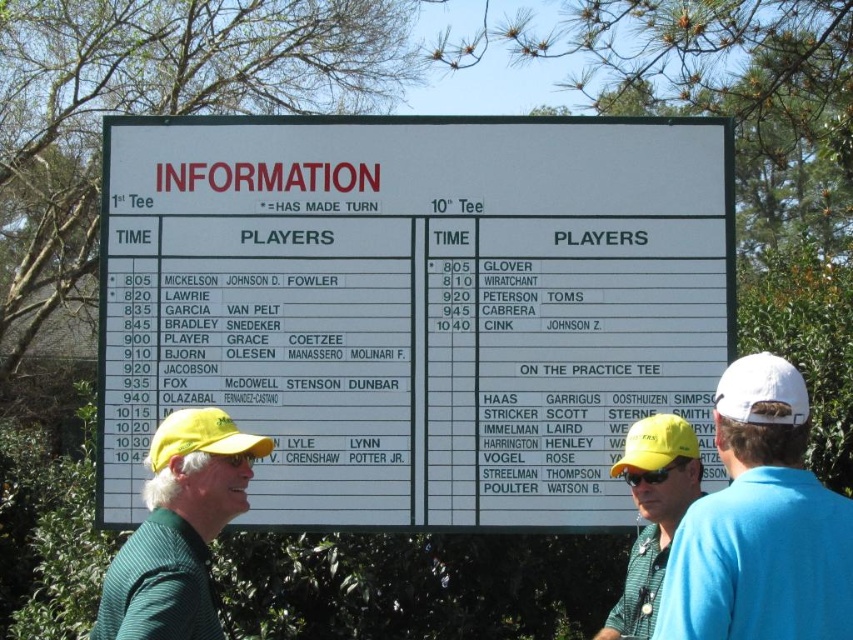
Does white plastic sign at center have a lesser width compared to yellow fabric cap at center?

No.

At what (x,y) coordinates should I click in order to perform the action: click on white plastic sign at center. Please return your answer as a coordinate pair (x, y). Looking at the image, I should click on (415, 305).

Is point (631, 589) positioned in front of point (775, 381)?

No, (631, 589) is further to viewer.

Which is in front, point (648, 637) or point (790, 376)?

Point (790, 376) is more forward.

Is point (608, 474) positioned after point (724, 401)?

Yes, point (608, 474) is behind point (724, 401).

At what (x,y) coordinates should I click in order to perform the action: click on yellow fabric cap at center. Please return your answer as a coordinate pair (x, y). Looking at the image, I should click on point(653,513).

Does blue cotton shirt at right lie behind yellow fabric cap at center?

No.

Is blue cotton shirt at right smaller than yellow fabric cap at center?

No, blue cotton shirt at right is not smaller than yellow fabric cap at center.

Where is `blue cotton shirt at right`? The height and width of the screenshot is (640, 853). blue cotton shirt at right is located at coordinates (759, 524).